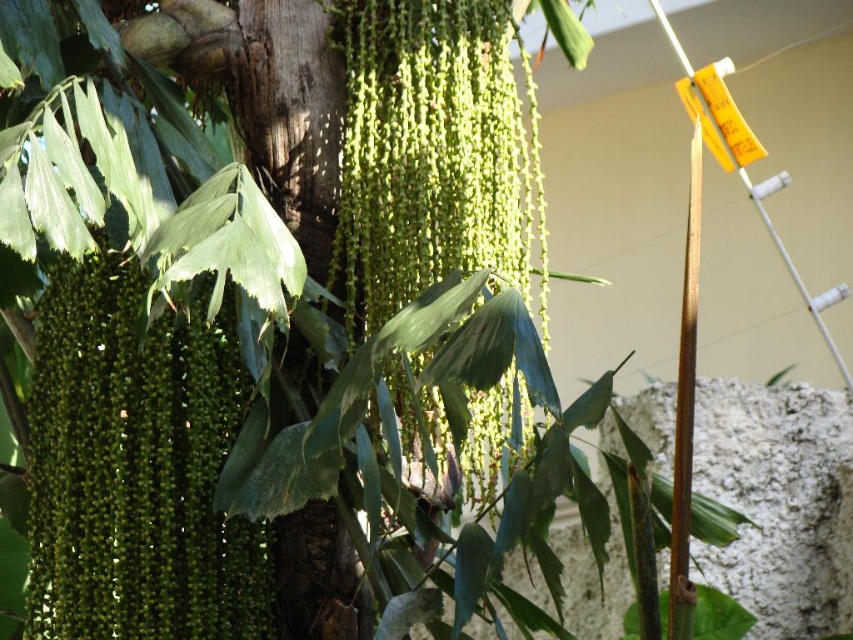
You are an arborist inspecting a plant. You notice the green matte seeds at center and the green textured tree trunk at center. Which object is located below the other?

The green matte seeds at center are positioned under the green textured tree trunk at center, so the seeds are below the tree trunk.

You are an artist sketching this plant. You want to draw the green matte seeds at center and the green textured tree trunk at center. Which object should you draw first if you want to start with the one that is more to the left?

The green matte seeds at center should be drawn first because it is positioned on the left side of the green textured tree trunk at center.

You are standing in front of the plant with long, slender, green seed pods hanging from its trunk. You see the point marked as point (136, 467). Is this point located on the green matte seeds at center?

The green matte seeds at center is represented by point (136, 467), so yes, the point is located on the green matte seeds at center.